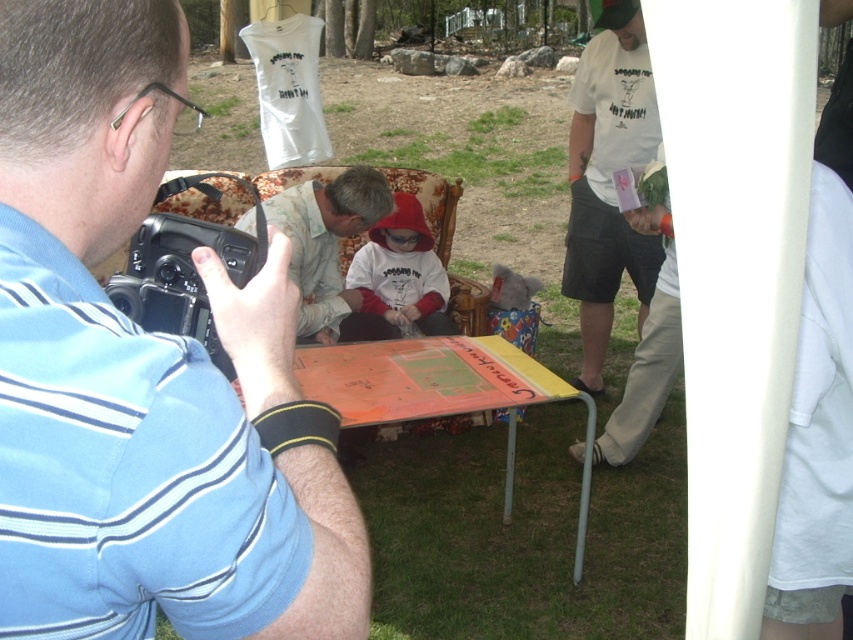
Who is more distant from viewer, (314,451) or (405,332)?

Point (405,332)

Image resolution: width=853 pixels, height=640 pixels. I want to click on blue striped shirt at upper left, so click(144, 374).

Who is positioned more to the left, orange painted wood picnic table at center or camouflage fabric shirt at center?

From the viewer's perspective, camouflage fabric shirt at center appears more on the left side.

Where is `orange painted wood picnic table at center`? The image size is (853, 640). orange painted wood picnic table at center is located at coordinates [x=432, y=384].

Is blue striped shirt at upper left in front of orange painted wood picnic table at center?

Yes, it is.

Where is `blue striped shirt at upper left`? blue striped shirt at upper left is located at coordinates (144, 374).